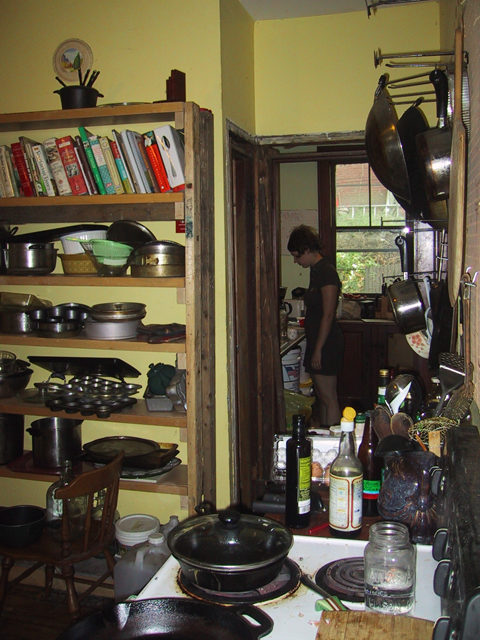
Find the location of a particular element. books is located at coordinates (131, 137).